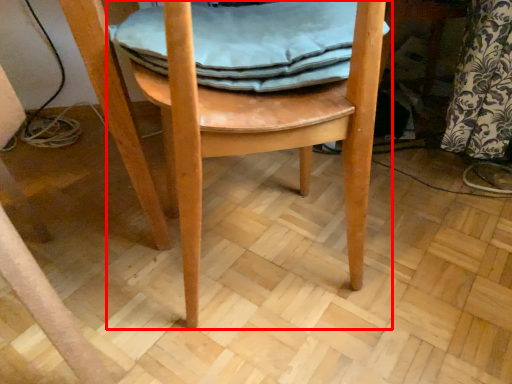
Question: In this image, where is chair (annotated by the red box) located relative to material?

Choices:
 (A) right
 (B) left

Answer: (B)